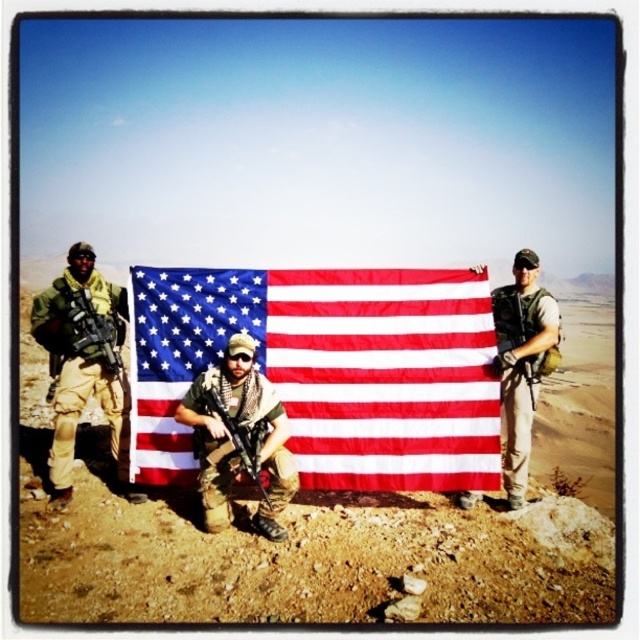
Question: Which point is farther from the camera taking this photo?

Choices:
 (A) (236, 320)
 (B) (216, 522)
 (C) (520, 387)
 (D) (248, 442)

Answer: (C)

Question: Does red-white striped flag at center have a smaller size compared to camouflage uniform at center?

Choices:
 (A) yes
 (B) no

Answer: (B)

Question: Can you confirm if camouflage uniform at left is positioned to the right of camouflage uniform at center?

Choices:
 (A) yes
 (B) no

Answer: (B)

Question: Which point appears farthest from the camera in this image?

Choices:
 (A) (61, 408)
 (B) (528, 317)
 (C) (349, 371)

Answer: (B)

Question: Can you confirm if red-white striped flag at center is positioned above matte black rifle at center?

Choices:
 (A) no
 (B) yes

Answer: (B)

Question: Which of these objects is positioned farthest from the camouflage uniform at center?

Choices:
 (A) camouflage uniform at left
 (B) camouflage fabric uniform at center
 (C) red-white striped flag at center
 (D) matte black rifle at center

Answer: (A)